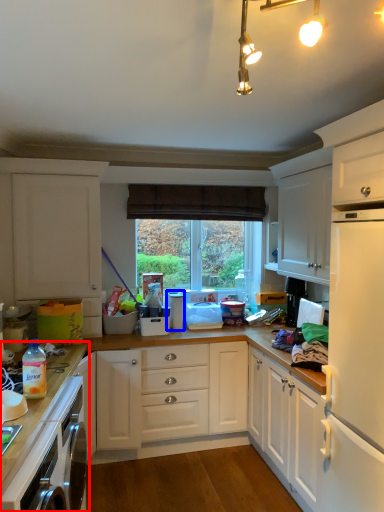
Question: Which object is closer to the camera taking this photo, countertop (highlighted by a red box) or appliance (highlighted by a blue box)?

Choices:
 (A) countertop
 (B) appliance

Answer: (A)